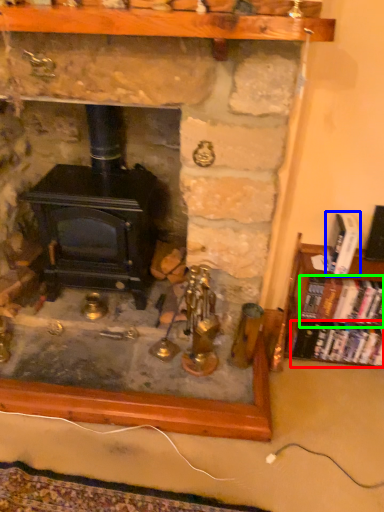
Question: Based on their relative distances, which object is farther from book (highlighted by a red box)? Choose from book (highlighted by a blue box) and book (highlighted by a green box).

Choices:
 (A) book
 (B) book

Answer: (A)